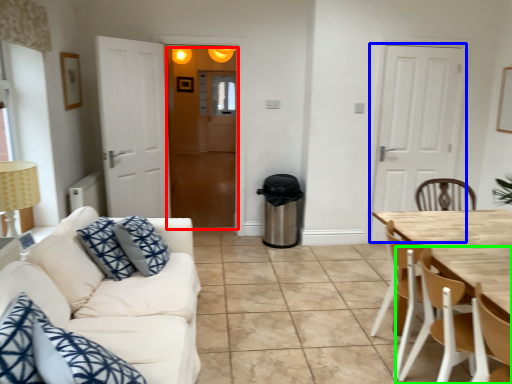
Question: Based on their relative distances, which object is nearer to glass door (highlighted by a red box)? Choose from door (highlighted by a blue box) and chair (highlighted by a green box).

Choices:
 (A) door
 (B) chair

Answer: (A)